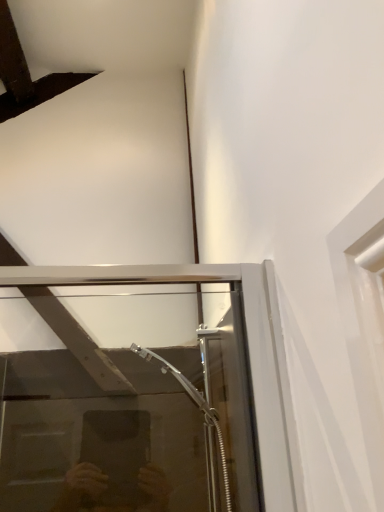
What do you see at coordinates (195, 403) in the screenshot? I see `polished chrome showerhead at center` at bounding box center [195, 403].

Identify the location of polished chrome showerhead at center. This screenshot has height=512, width=384. (195, 403).

Where is `polished chrome showerhead at center`? polished chrome showerhead at center is located at coordinates point(195,403).